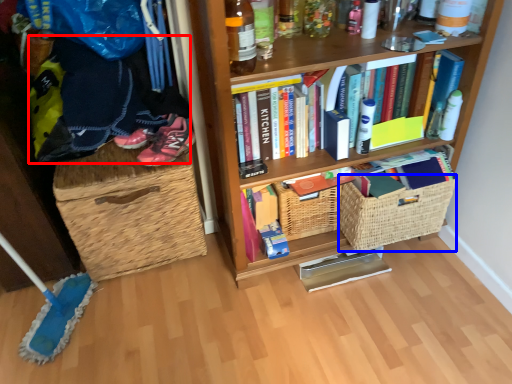
Question: Which object is further to the camera taking this photo, clothing (highlighted by a red box) or basket (highlighted by a blue box)?

Choices:
 (A) clothing
 (B) basket

Answer: (B)